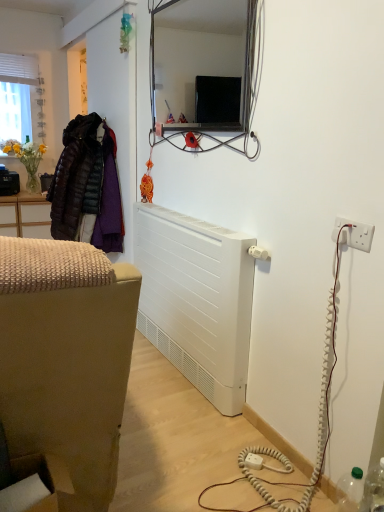
Question: From the image's perspective, relative to metallic frame mirror at upper center, is dark brown quilted jacket at left above or below?

Choices:
 (A) above
 (B) below

Answer: (B)

Question: In the image, is dark brown quilted jacket at left on the left side or the right side of metallic frame mirror at upper center?

Choices:
 (A) right
 (B) left

Answer: (B)

Question: Based on their relative distances, which object is nearer to the white plastic plug at lower center?

Choices:
 (A) transparent plastic bottle at lower right
 (B) dark brown quilted jacket at left
 (C) white plastic electrical outlet at right
 (D) metallic frame mirror at upper center
 (E) white matte radiator at lower center

Answer: (A)

Question: Estimate the real-world distances between objects in this image. Which object is farther from the metallic frame mirror at upper center?

Choices:
 (A) dark brown quilted jacket at left
 (B) transparent plastic bottle at lower right
 (C) white matte radiator at lower center
 (D) white plastic plug at lower center
 (E) white plastic electrical outlet at right

Answer: (B)